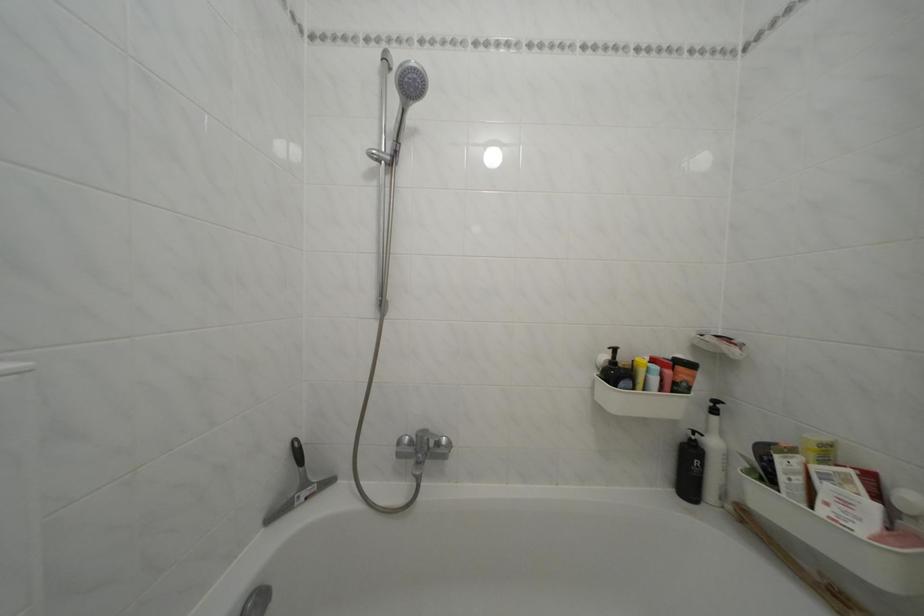
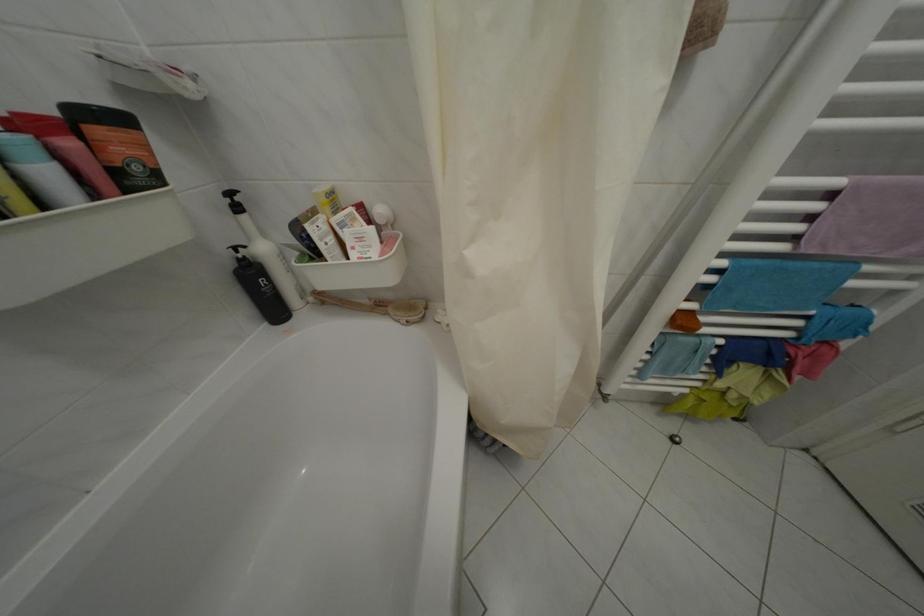
Where in the second image is the point corresponding to (822,454) from the first image?

(334, 206)